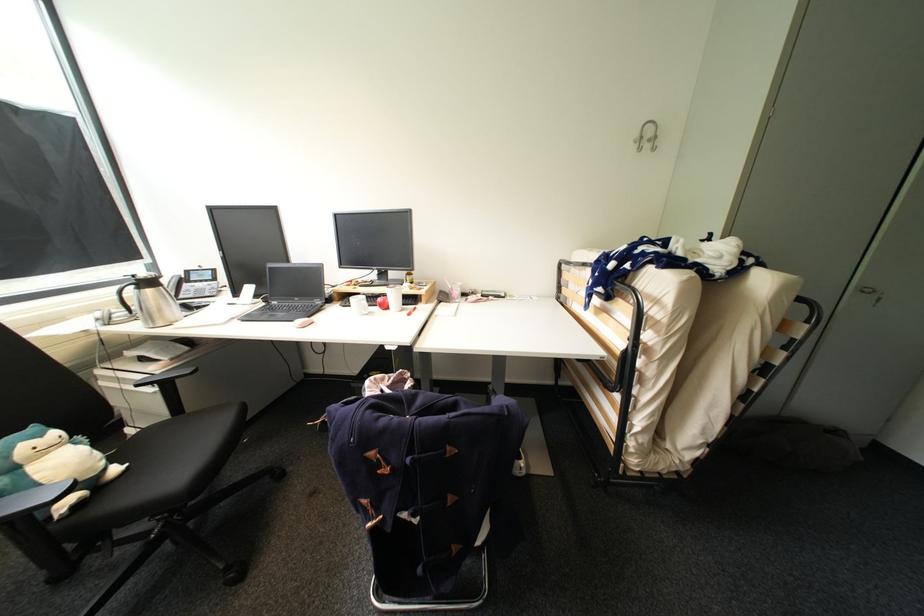
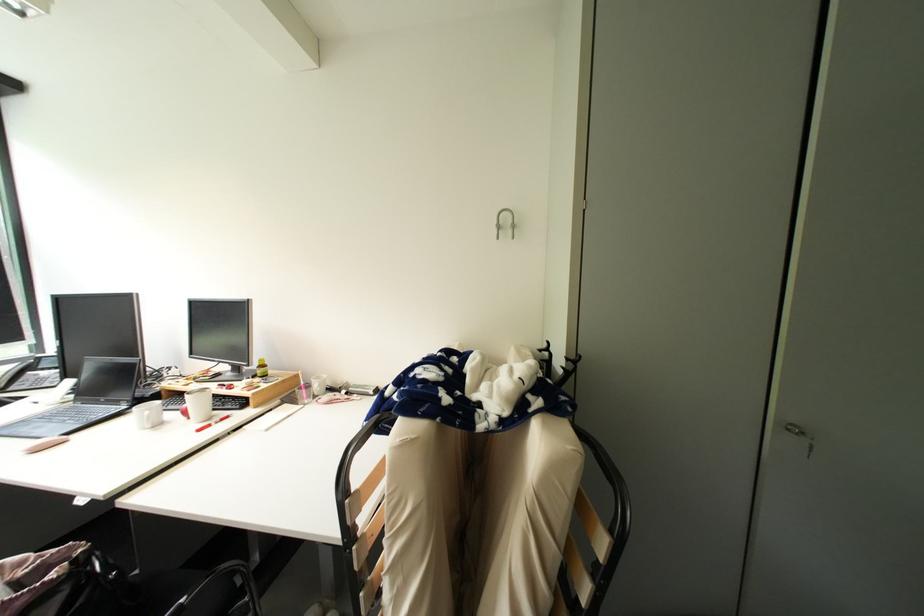
Question: The images are taken continuously from a first-person perspective. In which direction are you moving?

Choices:
 (A) Left
 (B) Right
 (C) Forward
 (D) Backward

Answer: (B)